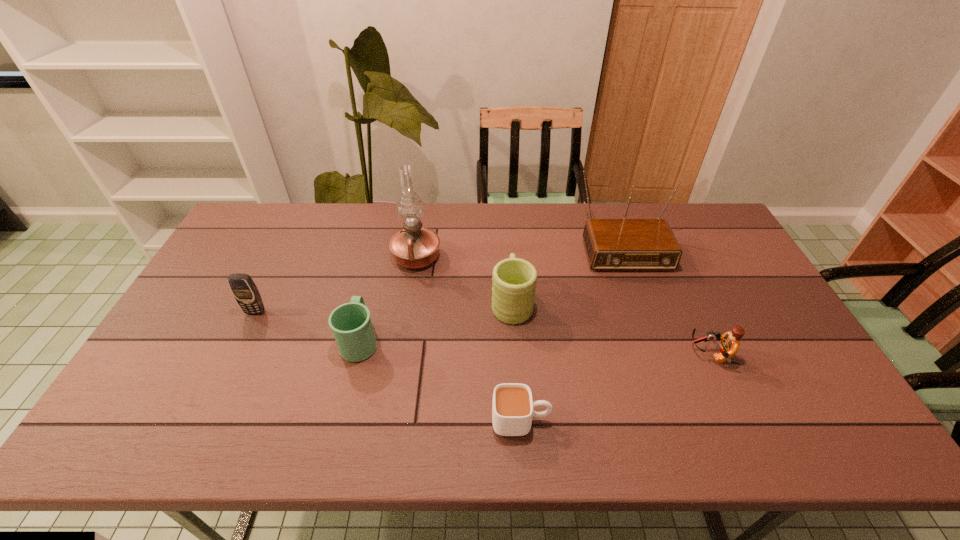
The height and width of the screenshot is (540, 960). What are the coordinates of `the tallest object` in the screenshot? It's located at (415, 247).

This screenshot has height=540, width=960. I want to click on the sixth shortest object, so click(x=611, y=244).

The height and width of the screenshot is (540, 960). Identify the location of the right mug. (514, 280).

The height and width of the screenshot is (540, 960). I want to click on the leftmost object, so click(x=242, y=286).

I want to click on the left mug, so click(351, 325).

What are the coordinates of `Lego` in the screenshot? It's located at (729, 345).

Where is `cup`? The width and height of the screenshot is (960, 540). cup is located at coordinates (512, 408).

I want to click on the nearest object, so click(x=512, y=408).

Locate an element on the screen. The height and width of the screenshot is (540, 960). free space located on the right of the tallest object is located at coordinates (474, 258).

At what (x,y) coordinates should I click in order to perform the action: click on vacant space positioned 0.160m on the front panel of the sixth shortest object. Please return your answer as a coordinate pair (x, y). The height and width of the screenshot is (540, 960). Looking at the image, I should click on (643, 311).